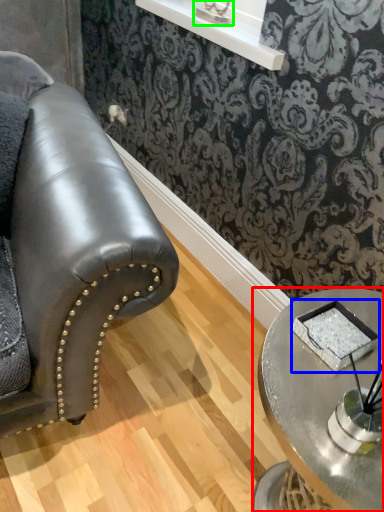
Question: Based on their relative distances, which object is nearer to table (highlighted by a red box)? Choose from pad (highlighted by a blue box) and table lamp (highlighted by a green box).

Choices:
 (A) pad
 (B) table lamp

Answer: (A)